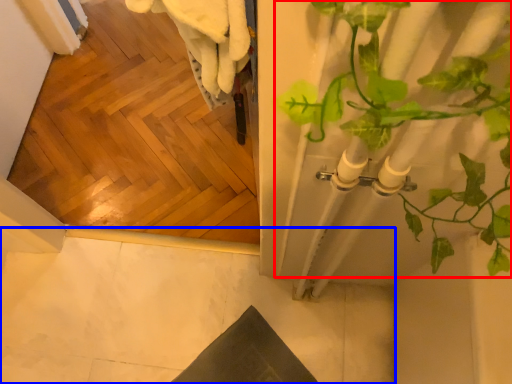
Question: Which point is further to the camera, houseplant (highlighted by a red box) or concrete (highlighted by a blue box)?

Choices:
 (A) houseplant
 (B) concrete

Answer: (B)